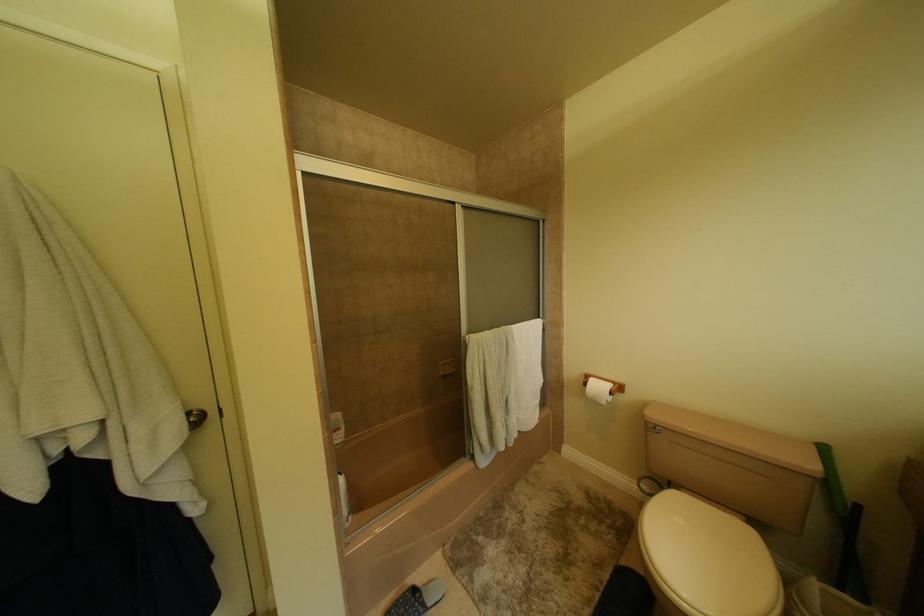
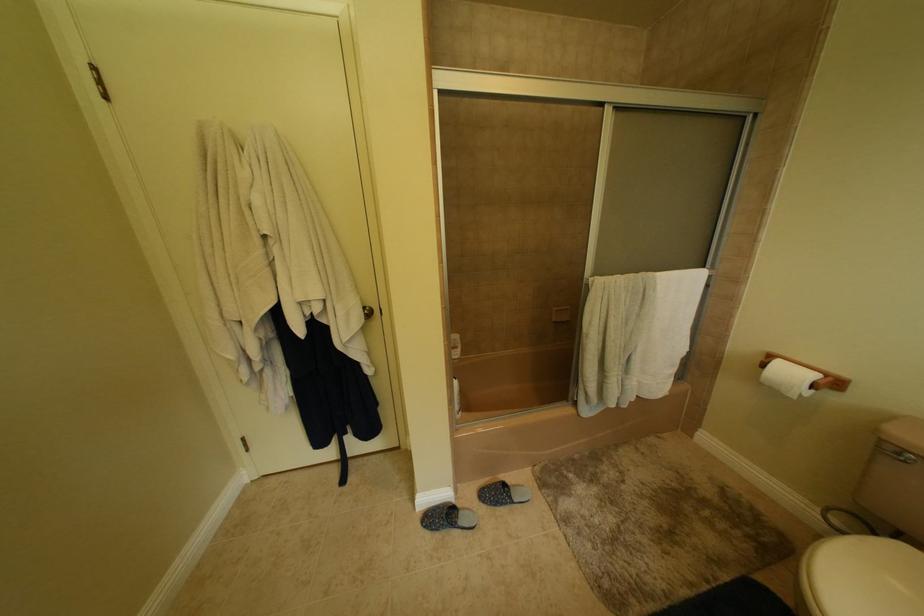
Question: The images are taken continuously from a first-person perspective. In which direction is your viewpoint rotating?

Choices:
 (A) Left
 (B) Right
 (C) Up
 (D) Down

Answer: (A)